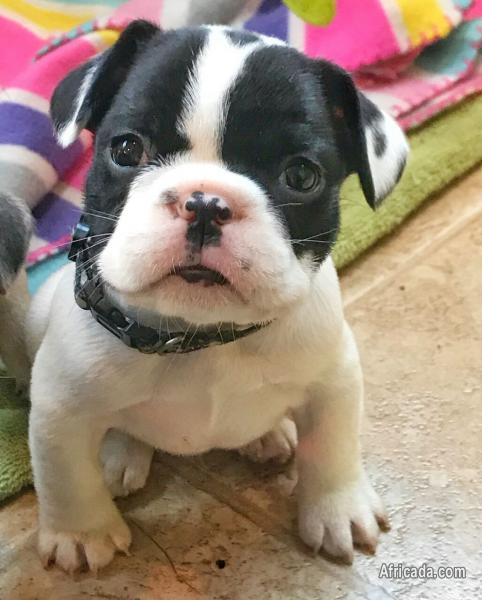
Where is `blanket`? blanket is located at coordinates (362, 238).